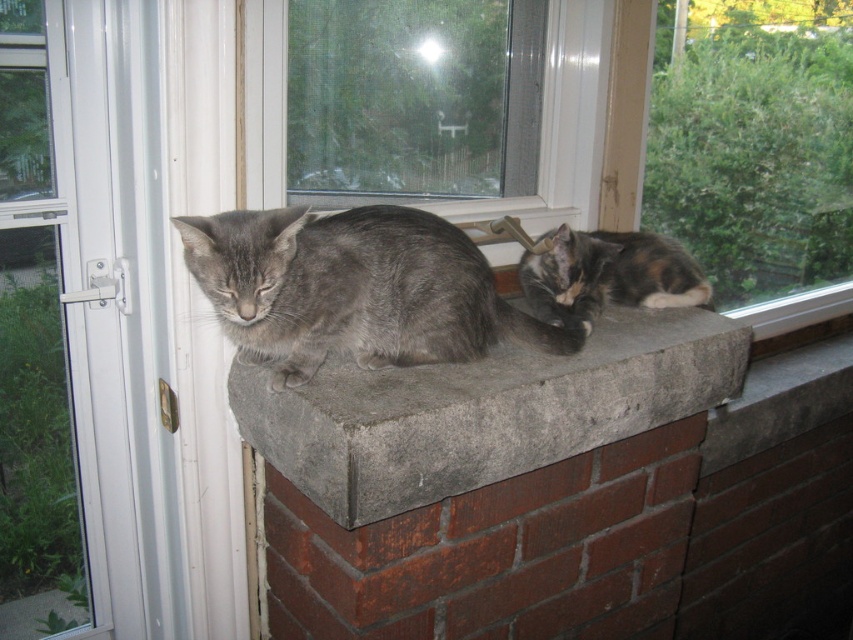
Question: Considering the relative positions of matte gray cat at center and gray soft fur cat at center in the image provided, where is matte gray cat at center located with respect to gray soft fur cat at center?

Choices:
 (A) right
 (B) left

Answer: (A)

Question: Does matte gray cat at center appear over calico fur cat at right?

Choices:
 (A) yes
 (B) no

Answer: (B)

Question: Which point is closer to the camera taking this photo?

Choices:
 (A) (799, 115)
 (B) (418, 397)
 (C) (515, 253)
 (D) (281, 228)

Answer: (D)

Question: Which of the following is the closest to the observer?

Choices:
 (A) (519, 72)
 (B) (231, 324)
 (C) (741, 163)
 (D) (554, 312)

Answer: (B)

Question: Which point appears farthest from the camera in this image?

Choices:
 (A) (378, 497)
 (B) (611, 278)
 (C) (305, 244)
 (D) (843, 168)

Answer: (D)

Question: Can you confirm if matte gray cat at center is thinner than calico fur cat at right?

Choices:
 (A) no
 (B) yes

Answer: (A)